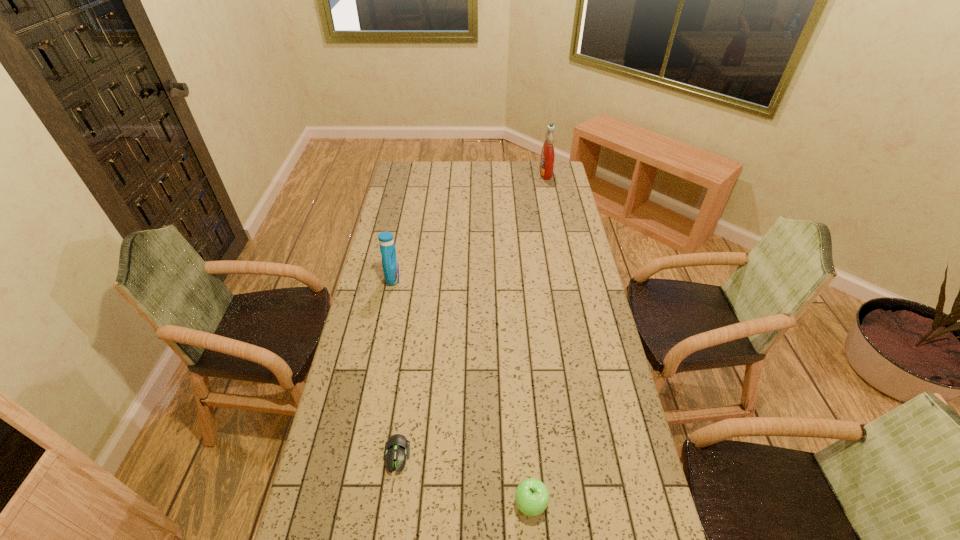
You are a GUI agent. You are given a task and a screenshot of the screen. Output one action in this format:
    pyautogui.click(x=<x>, y=<y>)
    Task: Click on the unoccupied area between the right detergent and the third object from left to right
    
    Given the screenshot: What is the action you would take?
    pyautogui.click(x=539, y=338)

Identify the location of the third closest object to the computer mouse. The image size is (960, 540). tap(547, 155).

Locate an element on the screen. object that is the second closest to the shortest object is located at coordinates (390, 264).

The height and width of the screenshot is (540, 960). In order to click on free space that satisfies the following two spatial constraints: 1. on the front-facing side of the nearer detergent; 2. on the left side of the computer mouse in this screenshot , I will do `click(357, 455)`.

What are the coordinates of `free region that satisfies the following two spatial constraints: 1. on the front surface of the taller detergent; 2. on the front side of the third object from left to right` in the screenshot? It's located at (613, 503).

Identify the location of vacant space that satisfies the following two spatial constraints: 1. on the front-facing side of the nearer detergent; 2. on the right side of the second object from right to left. This screenshot has width=960, height=540. (348, 503).

You are a GUI agent. You are given a task and a screenshot of the screen. Output one action in this format:
    pyautogui.click(x=<x>, y=<y>)
    Task: Click on the free space that satisfies the following two spatial constraints: 1. on the front-facing side of the second tallest object; 2. on the right side of the second shortest object
    
    Given the screenshot: What is the action you would take?
    coord(348,503)

Find the location of a particular element. The height and width of the screenshot is (540, 960). blank space that satisfies the following two spatial constraints: 1. on the front-facing side of the second nearest object; 2. on the right side of the left detergent is located at coordinates coord(357,455).

The image size is (960, 540). What are the coordinates of `free location that satisfies the following two spatial constraints: 1. on the front-facing side of the left detergent; 2. on the back side of the shortest object` in the screenshot? It's located at (357, 455).